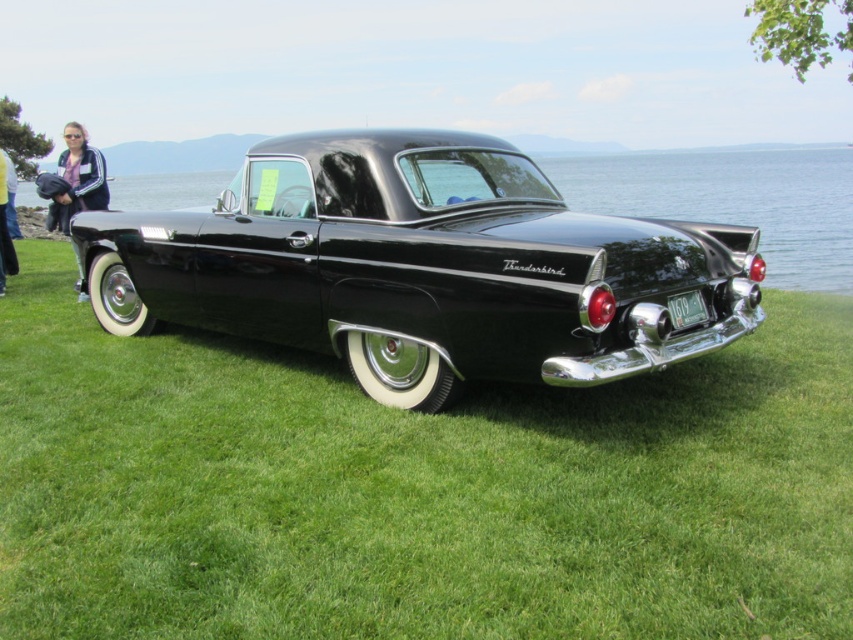
You are a photographer trying to capture the glossy black thunderbird at center and the matte black jacket at left in a single shot. Since you want both subjects to be in focus, you need to adjust your camera settings. Which subject is closer to the camera, requiring you to focus on it first?

The glossy black thunderbird at center is closer to the camera than the matte black jacket at left, so you should focus on the glossy black thunderbird at center first to ensure both are in focus.

You are standing in front of the classic black Ford Thunderbird parked on the grassy area near the water. There are two points marked on the car. The first point is at coordinates point (392,216) and the second is at point (4,225). Which of these points is closer to you?

Point (392,216) is closer to the viewer than point (4,225).